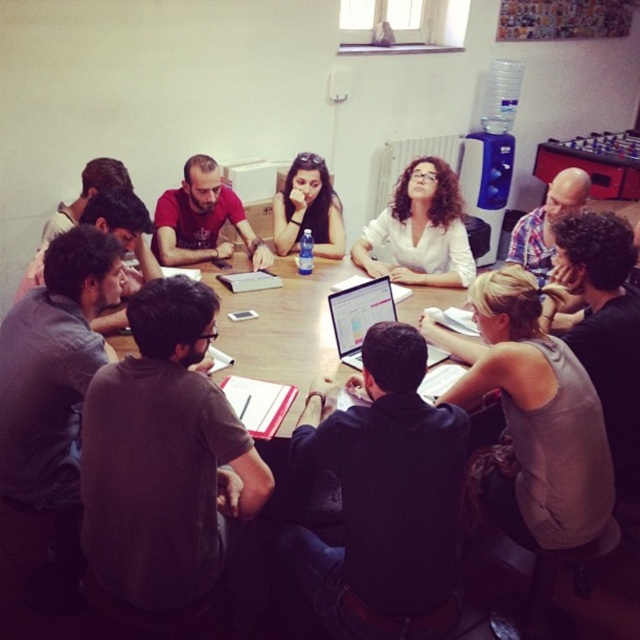
Image resolution: width=640 pixels, height=640 pixels. I want to click on bald man in plaid shirt at upper right, so click(x=547, y=221).

Does bald man in plaid shirt at upper right appear over silver metallic laptop at center?

Yes.

Who is more forward, (548,260) or (372,280)?

Point (372,280)

Locate an element on the screen. The height and width of the screenshot is (640, 640). bald man in plaid shirt at upper right is located at coordinates (547, 221).

Does point (449, 184) lie behind point (193, 221)?

No, (449, 184) is in front of (193, 221).

Is white glossy shirt at upper center positioned at the back of matte red shirt at center?

No, it is in front of matte red shirt at center.

What do you see at coordinates (419, 230) in the screenshot? I see `white glossy shirt at upper center` at bounding box center [419, 230].

At what (x,y) coordinates should I click in order to perform the action: click on white glossy shirt at upper center. Please return your answer as a coordinate pair (x, y). This screenshot has width=640, height=640. Looking at the image, I should click on (419, 230).

Is matte black hair at center to the left of bald man in plaid shirt at upper right from the viewer's perspective?

Correct, you'll find matte black hair at center to the left of bald man in plaid shirt at upper right.

The image size is (640, 640). Identify the location of matte black hair at center. (308, 209).

Find the location of `matte black hair at center`. matte black hair at center is located at coordinates (308, 209).